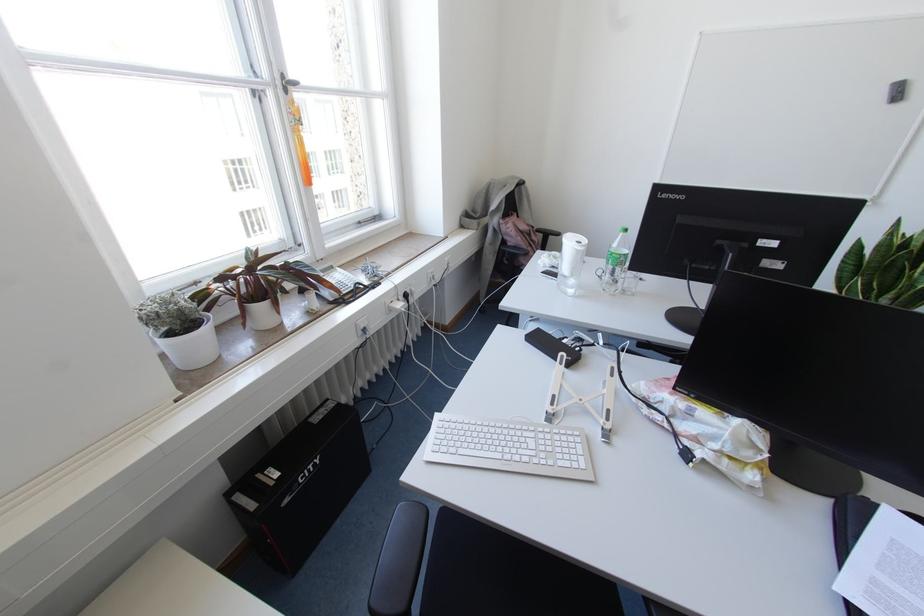
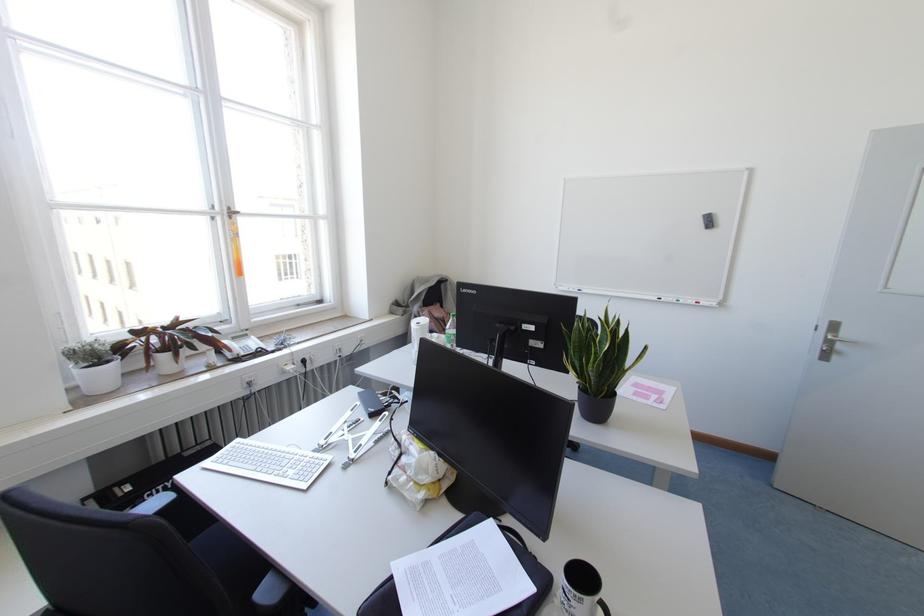
Question: I am providing you with two images of the same scene from different viewpoints. After the viewpoint changes to image2, which objects are now occluded?

Choices:
 (A) blue whiteboard marker
 (B) grey whiteboard eraser
 (C) white water bottle
 (D) none of these

Answer: (D)